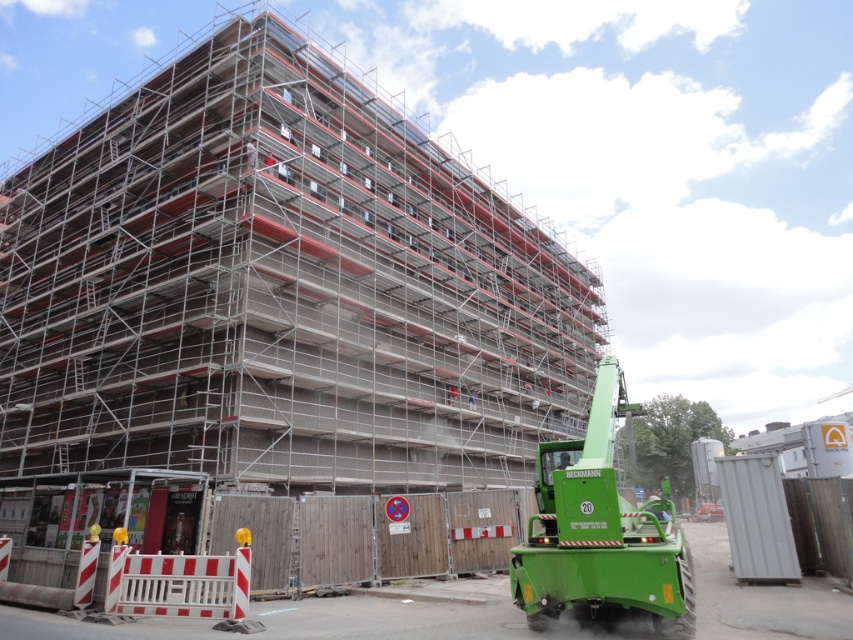
You are a safety inspector at the construction site. You need to ensure that the red and white plastic barricade at lower left is visible to workers passing by. Considering the size difference between the silver metallic scaffolding at center and the barricade, will the barricade be easily noticeable from a distance?

The silver metallic scaffolding at center is larger than the red and white plastic barricade at lower left. Since the scaffolding is bigger, it might block the view of the barricade, making it less noticeable to workers from a distance.

You are a construction worker standing at the entrance of the building site. You need to move a heavy beam from the green metallic crane at lower right to the silver metallic scaffolding at center. Which direction should you move the beam to place it correctly?

You should move the beam to the left because the silver metallic scaffolding at center is to the left of the green metallic crane at lower right.

You are a construction worker standing at the point labeled point (601, 531). You need to move to the nearest ladder to climb up the scaffolding. Which direction should you walk to reach the nearest ladder?

The point (601, 531) is the location of the green metallic crane at lower right, so you should walk towards the scaffolding structure to find the nearest ladder.